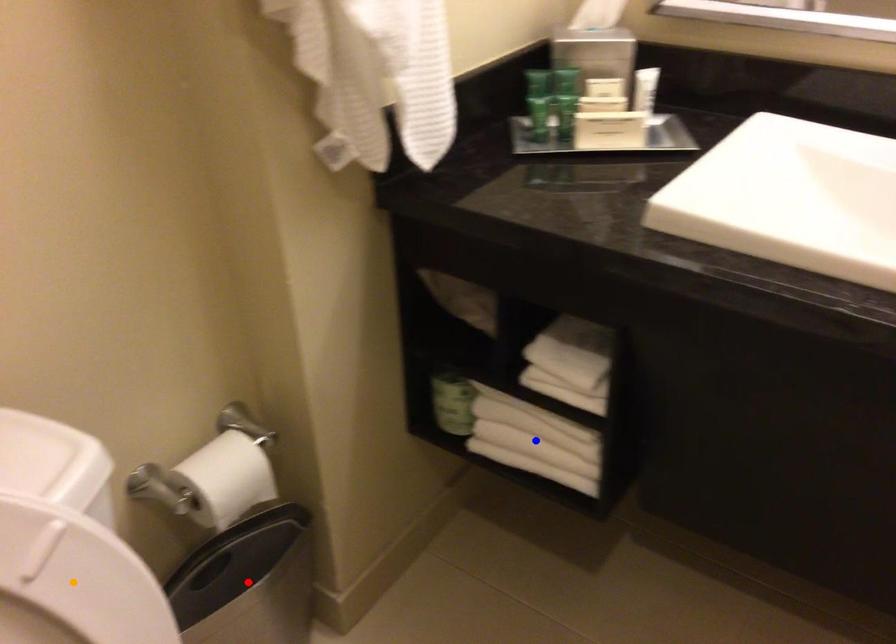
Order these from farthest to nearest:
- blue point
- orange point
- red point

blue point < red point < orange point